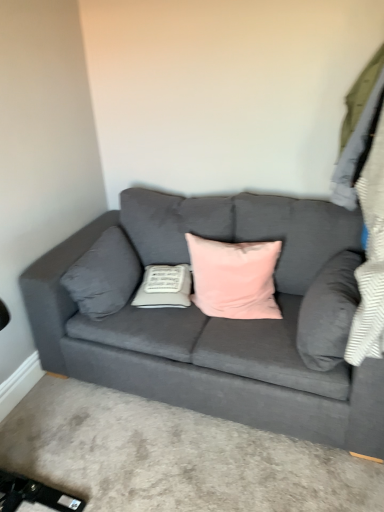
Question: Considering the relative sizes of velvet gray pillow at right, marked as the first pillow in a right-to-left arrangement, and pink velvet pillow at center, placed as the 2th pillow when sorted from right to left, in the image provided, is velvet gray pillow at right, marked as the first pillow in a right-to-left arrangement, bigger than pink velvet pillow at center, placed as the 2th pillow when sorted from right to left,?

Choices:
 (A) yes
 (B) no

Answer: (B)

Question: Is velvet gray pillow at right, marked as the first pillow in a right-to-left arrangement, oriented away from pink velvet pillow at center, the third pillow in the left-to-right sequence?

Choices:
 (A) no
 (B) yes

Answer: (A)

Question: Does velvet gray pillow at right, the fourth pillow from the left, appear on the right side of pink velvet pillow at center, placed as the 2th pillow when sorted from right to left?

Choices:
 (A) no
 (B) yes

Answer: (B)

Question: Is velvet gray pillow at right, the fourth pillow from the left, far from pink velvet pillow at center, the third pillow in the left-to-right sequence?

Choices:
 (A) yes
 (B) no

Answer: (B)

Question: Does velvet gray pillow at right, the fourth pillow from the left, have a lesser width compared to pink velvet pillow at center, the third pillow in the left-to-right sequence?

Choices:
 (A) no
 (B) yes

Answer: (B)

Question: Would you say velvet gray pillow at right, the fourth pillow from the left, is outside pink velvet pillow at center, the third pillow in the left-to-right sequence?

Choices:
 (A) yes
 (B) no

Answer: (A)

Question: From the image's perspective, is white fabric pillow at center, the third pillow in the right-to-left sequence, below velvet gray couch at center?

Choices:
 (A) yes
 (B) no

Answer: (B)

Question: Considering the relative sizes of white fabric pillow at center, placed as the second pillow when sorted from left to right, and velvet gray couch at center in the image provided, is white fabric pillow at center, placed as the second pillow when sorted from left to right, bigger than velvet gray couch at center?

Choices:
 (A) no
 (B) yes

Answer: (A)

Question: Is white fabric pillow at center, placed as the second pillow when sorted from left to right, positioned with its back to velvet gray couch at center?

Choices:
 (A) yes
 (B) no

Answer: (A)

Question: Is white fabric pillow at center, placed as the second pillow when sorted from left to right, to the left of velvet gray couch at center from the viewer's perspective?

Choices:
 (A) yes
 (B) no

Answer: (A)

Question: From a real-world perspective, is white fabric pillow at center, the third pillow in the right-to-left sequence, physically above velvet gray couch at center?

Choices:
 (A) yes
 (B) no

Answer: (A)

Question: Is white fabric pillow at center, the third pillow in the right-to-left sequence, wider than velvet gray couch at center?

Choices:
 (A) no
 (B) yes

Answer: (A)

Question: From the image's perspective, would you say gray fabric pillow at left, marked as the 1th pillow in a left-to-right arrangement, is shown under velvet gray pillow at right, marked as the first pillow in a right-to-left arrangement?

Choices:
 (A) yes
 (B) no

Answer: (B)